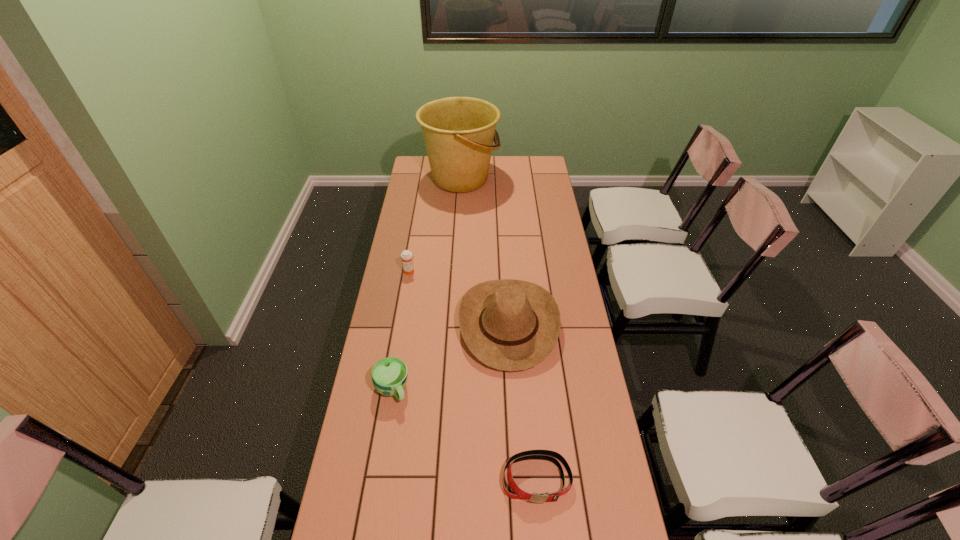
At what (x,y) coordinates should I click in order to perform the action: click on the tallest object. Please return your answer as a coordinate pair (x, y). Image resolution: width=960 pixels, height=540 pixels. Looking at the image, I should click on (458, 132).

Identify the location of the farthest object. (458, 132).

At what (x,y) coordinates should I click in order to perform the action: click on cowboy hat. Please return your answer as a coordinate pair (x, y). The height and width of the screenshot is (540, 960). Looking at the image, I should click on coord(511,325).

This screenshot has height=540, width=960. I want to click on the third tallest object, so click(406, 256).

I want to click on medicine, so click(x=406, y=256).

Find the location of `the fourth tallest object`. the fourth tallest object is located at coordinates (389, 375).

Where is `the shortest object`? the shortest object is located at coordinates (552, 456).

Where is `dog collar`? This screenshot has width=960, height=540. dog collar is located at coordinates (552, 456).

Identify the location of vacant space situated 0.280m on the side of the bucket with the handle. (551, 179).

The width and height of the screenshot is (960, 540). What are the coordinates of `free space located on the front-facing side of the second tallest object` in the screenshot? It's located at (395, 325).